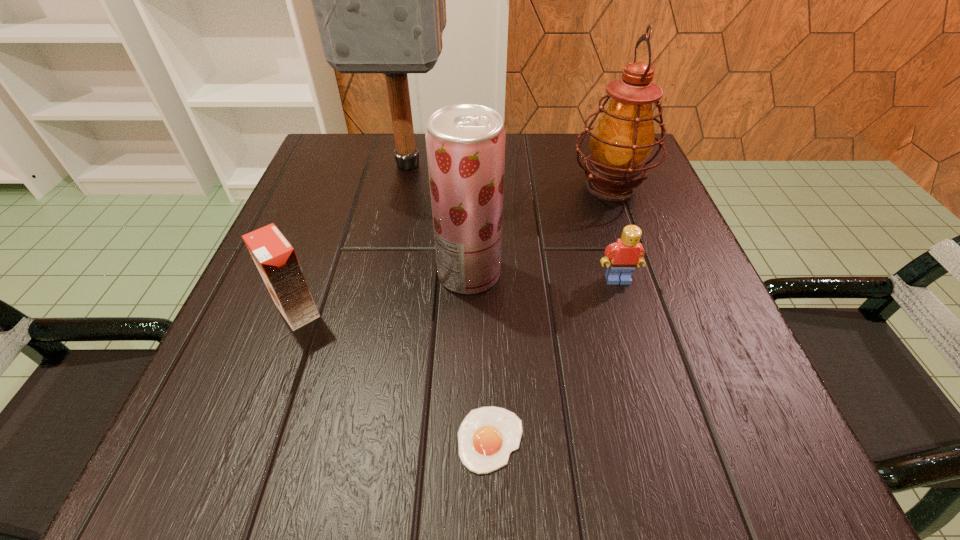
At what (x,y) coordinates should I click in order to perform the action: click on free area in between the egg yolk and the tallest object. Please return your answer as a coordinate pair (x, y). The width and height of the screenshot is (960, 540). Looking at the image, I should click on (449, 301).

The image size is (960, 540). I want to click on unoccupied position between the mallet and the oil lamp, so pos(510,175).

Locate an element on the screen. Image resolution: width=960 pixels, height=540 pixels. free space between the fruit juice and the oil lamp is located at coordinates (540, 230).

The image size is (960, 540). What are the coordinates of `free space between the nearest object and the mallet` in the screenshot? It's located at (449, 301).

At what (x,y) coordinates should I click in order to perform the action: click on empty space that is in between the tallest object and the shortest object. Please return your answer as a coordinate pair (x, y). This screenshot has height=540, width=960. Looking at the image, I should click on (449, 301).

This screenshot has width=960, height=540. Identify the location of vacant space that's between the oil lamp and the mallet. (510, 175).

The width and height of the screenshot is (960, 540). What are the coordinates of `vacant point located between the mallet and the oil lamp` in the screenshot? It's located at (510, 175).

Locate which object is the second closest to the Lego. Please provide its 2D coordinates. Your answer should be formatted as a tuple, i.e. [(x, y)], where the tuple contains the x and y coordinates of a point satisfying the conditions above.

[(622, 140)]

This screenshot has height=540, width=960. Find the location of `object that is the fifth nearest to the fruit juice`. object that is the fifth nearest to the fruit juice is located at coordinates (487, 435).

Locate an element on the screen. free space in the image that satisfies the following two spatial constraints: 1. on the striking surface of the tallest object; 2. on the right side of the fruit juice is located at coordinates (385, 274).